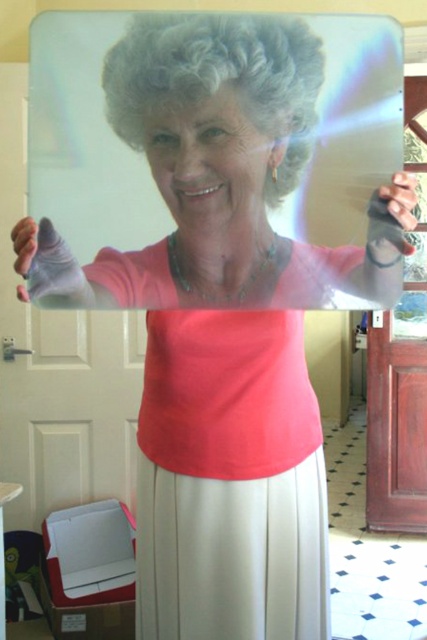
You are an interior designer assessing the layout of this room. You notice a point at coordinates [219,76]. What object is located at that point?

The point at coordinates [219,76] corresponds to the curly gray wig at upper center.

You are a fashion designer observing the person in the image. You need to decide which glove is more suitable for a winter collection based on their size. Which glove between the matte pink glove at left and the matte black glove at upper right is taller?

The matte pink glove at left is taller than the matte black glove at upper right, making it more suitable for a winter collection as taller gloves provide better coverage against cold weather.